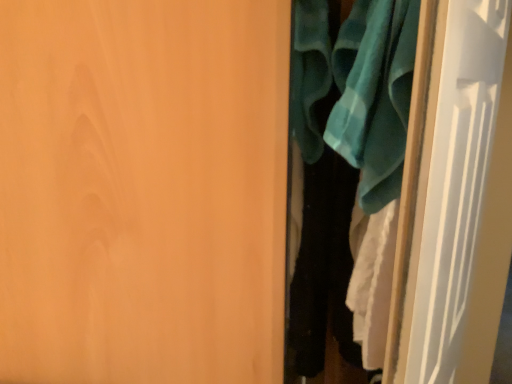
You are a GUI agent. You are given a task and a screenshot of the screen. Output one action in this format:
    pyautogui.click(x=<x>, y=<y>)
    Task: Click on the matte wood door at center, marked as the 2th door in a right-to-left arrangement
    Image resolution: width=512 pixels, height=384 pixels.
    Given the screenshot: What is the action you would take?
    pyautogui.click(x=143, y=190)

Image resolution: width=512 pixels, height=384 pixels. Describe the element at coordinates (461, 201) in the screenshot. I see `white glossy door at right, the second door viewed from the left` at that location.

Locate an element on the screen. This screenshot has height=384, width=512. teal fabric clothes at right is located at coordinates (340, 161).

You are a GUI agent. You are given a task and a screenshot of the screen. Output one action in this format:
    pyautogui.click(x=<x>, y=<y>)
    Task: Click on the teal fabric bath towel at upper right
    This screenshot has height=384, width=512.
    Given the screenshot: What is the action you would take?
    pyautogui.click(x=374, y=95)

Considering the relative positions of matte wood door at center, arranged as the first door when viewed from the left, and teal fabric bath towel at upper right in the image provided, is matte wood door at center, arranged as the first door when viewed from the left, to the left of teal fabric bath towel at upper right from the viewer's perspective?

Yes.

Is the depth of matte wood door at center, marked as the 2th door in a right-to-left arrangement, greater than that of teal fabric bath towel at upper right?

No, it is in front of teal fabric bath towel at upper right.

From a real-world perspective, is matte wood door at center, marked as the 2th door in a right-to-left arrangement, positioned above or below teal fabric bath towel at upper right?

matte wood door at center, marked as the 2th door in a right-to-left arrangement, is situated lower than teal fabric bath towel at upper right in the real world.

In the scene shown: From a real-world perspective, is teal fabric clothes at right above or below matte wood door at center, arranged as the first door when viewed from the left?

teal fabric clothes at right is above matte wood door at center, arranged as the first door when viewed from the left.

Considering the positions of objects teal fabric clothes at right and matte wood door at center, arranged as the first door when viewed from the left, in the image provided, who is behind, teal fabric clothes at right or matte wood door at center, arranged as the first door when viewed from the left,?

teal fabric clothes at right is further from the camera.

Considering the sizes of teal fabric clothes at right and matte wood door at center, arranged as the first door when viewed from the left, in the image, is teal fabric clothes at right taller or shorter than matte wood door at center, arranged as the first door when viewed from the left,?

Clearly, teal fabric clothes at right is shorter compared to matte wood door at center, arranged as the first door when viewed from the left.

Is matte wood door at center, marked as the 2th door in a right-to-left arrangement, surrounded by teal fabric bath towel at upper right?

Definitely not — matte wood door at center, marked as the 2th door in a right-to-left arrangement, is not inside teal fabric bath towel at upper right.

Considering their positions, is teal fabric bath towel at upper right located in front of or behind matte wood door at center, arranged as the first door when viewed from the left?

teal fabric bath towel at upper right is behind matte wood door at center, arranged as the first door when viewed from the left.

Which object is thinner, teal fabric bath towel at upper right or matte wood door at center, marked as the 2th door in a right-to-left arrangement?

Thinner between the two is teal fabric bath towel at upper right.

From a real-world perspective, is teal fabric bath towel at upper right positioned under matte wood door at center, marked as the 2th door in a right-to-left arrangement, based on gravity?

No, from a real-world perspective, teal fabric bath towel at upper right is not under matte wood door at center, marked as the 2th door in a right-to-left arrangement.

Is teal fabric bath towel at upper right in front of or behind teal fabric clothes at right in the image?

teal fabric bath towel at upper right is positioned closer to the viewer than teal fabric clothes at right.

Considering the sizes of teal fabric bath towel at upper right and teal fabric clothes at right in the image, is teal fabric bath towel at upper right taller or shorter than teal fabric clothes at right?

Clearly, teal fabric bath towel at upper right is shorter compared to teal fabric clothes at right.

Is teal fabric clothes at right a part of teal fabric bath towel at upper right?

Yes, teal fabric bath towel at upper right is surrounding teal fabric clothes at right.

From a real-world perspective, does teal fabric bath towel at upper right sit lower than teal fabric clothes at right?

No, from a real-world perspective, teal fabric bath towel at upper right is not under teal fabric clothes at right.

From the picture: Is white glossy door at right, the second door viewed from the left, looking in the opposite direction of matte wood door at center, marked as the 2th door in a right-to-left arrangement?

Yes, matte wood door at center, marked as the 2th door in a right-to-left arrangement, is at the back of white glossy door at right, the second door viewed from the left.

From the image's perspective, between white glossy door at right, the second door viewed from the left, and matte wood door at center, arranged as the first door when viewed from the left, which one is located above?

white glossy door at right, the second door viewed from the left, is shown above in the image.

Consider the image. Can you tell me how much white glossy door at right, which ranks as the 1th door in right-to-left order, and matte wood door at center, arranged as the first door when viewed from the left, differ in facing direction?

5.54 degrees separate the facing orientations of white glossy door at right, which ranks as the 1th door in right-to-left order, and matte wood door at center, arranged as the first door when viewed from the left.

Can you confirm if white glossy door at right, which ranks as the 1th door in right-to-left order, is smaller than matte wood door at center, marked as the 2th door in a right-to-left arrangement?

Correct, white glossy door at right, which ranks as the 1th door in right-to-left order, occupies less space than matte wood door at center, marked as the 2th door in a right-to-left arrangement.

Who is taller, white glossy door at right, which ranks as the 1th door in right-to-left order, or teal fabric bath towel at upper right?

white glossy door at right, which ranks as the 1th door in right-to-left order, is taller.

Is white glossy door at right, the second door viewed from the left, not close to teal fabric bath towel at upper right?

white glossy door at right, the second door viewed from the left, is near teal fabric bath towel at upper right, not far away.

What's the angular difference between white glossy door at right, the second door viewed from the left, and teal fabric bath towel at upper right's facing directions?

The angle between the facing direction of white glossy door at right, the second door viewed from the left, and the facing direction of teal fabric bath towel at upper right is 0.00587 degrees.

Is white glossy door at right, the second door viewed from the left, facing towards teal fabric clothes at right?

Yes, white glossy door at right, the second door viewed from the left, faces towards teal fabric clothes at right.

Does point (452, 31) come in front of point (397, 156)?

Yes, point (452, 31) is in front of point (397, 156).

Is white glossy door at right, which ranks as the 1th door in right-to-left order, next to teal fabric clothes at right?

They are not placed beside each other.

At what (x,y) coordinates should I click in order to perform the action: click on door that is on the left side of teal fabric bath towel at upper right. Please return your answer as a coordinate pair (x, y). The height and width of the screenshot is (384, 512). Looking at the image, I should click on (143, 190).

The width and height of the screenshot is (512, 384). Identify the location of the 2nd door below when counting from the teal fabric clothes at right (from the image's perspective). (143, 190).

Based on their spatial positions, is white glossy door at right, the second door viewed from the left, or matte wood door at center, marked as the 2th door in a right-to-left arrangement, further from teal fabric bath towel at upper right?

matte wood door at center, marked as the 2th door in a right-to-left arrangement, is further to teal fabric bath towel at upper right.

Based on their spatial positions, is matte wood door at center, marked as the 2th door in a right-to-left arrangement, or teal fabric clothes at right closer to white glossy door at right, which ranks as the 1th door in right-to-left order?

Among the two, teal fabric clothes at right is located nearer to white glossy door at right, which ranks as the 1th door in right-to-left order.

In the scene shown: Which object lies further to the anchor point teal fabric clothes at right, matte wood door at center, marked as the 2th door in a right-to-left arrangement, or white glossy door at right, which ranks as the 1th door in right-to-left order?

matte wood door at center, marked as the 2th door in a right-to-left arrangement, is positioned further to the anchor teal fabric clothes at right.

Which object lies nearer to the anchor point white glossy door at right, which ranks as the 1th door in right-to-left order, teal fabric bath towel at upper right or matte wood door at center, marked as the 2th door in a right-to-left arrangement?

Based on the image, teal fabric bath towel at upper right appears to be nearer to white glossy door at right, which ranks as the 1th door in right-to-left order.

When comparing their distances from matte wood door at center, marked as the 2th door in a right-to-left arrangement, does white glossy door at right, which ranks as the 1th door in right-to-left order, or teal fabric bath towel at upper right seem further?

Based on the image, white glossy door at right, which ranks as the 1th door in right-to-left order, appears to be further to matte wood door at center, marked as the 2th door in a right-to-left arrangement.

Based on their spatial positions, is white glossy door at right, which ranks as the 1th door in right-to-left order, or matte wood door at center, marked as the 2th door in a right-to-left arrangement, closer to teal fabric clothes at right?

Based on the image, white glossy door at right, which ranks as the 1th door in right-to-left order, appears to be nearer to teal fabric clothes at right.

Consider the image. When comparing their distances from white glossy door at right, the second door viewed from the left, does teal fabric clothes at right or matte wood door at center, marked as the 2th door in a right-to-left arrangement, seem closer?

teal fabric clothes at right.

When comparing their distances from teal fabric clothes at right, does matte wood door at center, marked as the 2th door in a right-to-left arrangement, or teal fabric bath towel at upper right seem further?

Among the two, matte wood door at center, marked as the 2th door in a right-to-left arrangement, is located further to teal fabric clothes at right.

Find the location of `bath towel located between matte wood door at center, arranged as the first door when viewed from the left, and teal fabric clothes at right in the depth direction`. bath towel located between matte wood door at center, arranged as the first door when viewed from the left, and teal fabric clothes at right in the depth direction is located at coordinates (374, 95).

The width and height of the screenshot is (512, 384). I want to click on bath towel located between matte wood door at center, marked as the 2th door in a right-to-left arrangement, and white glossy door at right, which ranks as the 1th door in right-to-left order, in the left-right direction, so click(x=374, y=95).

Where is `closet between matte wood door at center, arranged as the first door when viewed from the left, and white glossy door at right, which ranks as the 1th door in right-to-left order`? This screenshot has height=384, width=512. closet between matte wood door at center, arranged as the first door when viewed from the left, and white glossy door at right, which ranks as the 1th door in right-to-left order is located at coordinates (340, 161).

At what (x,y) coordinates should I click in order to perform the action: click on closet between teal fabric bath towel at upper right and white glossy door at right, which ranks as the 1th door in right-to-left order, from top to bottom. Please return your answer as a coordinate pair (x, y). Looking at the image, I should click on (x=340, y=161).